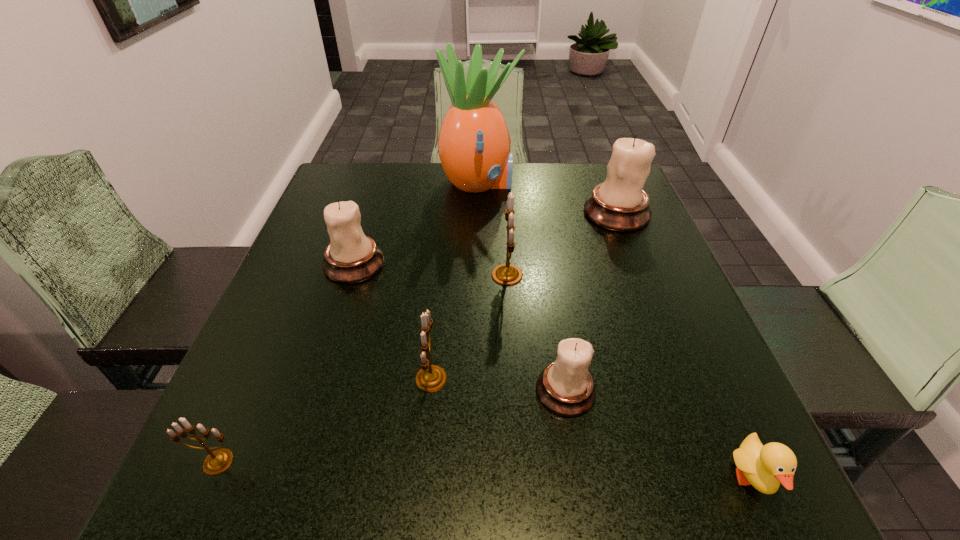
Image resolution: width=960 pixels, height=540 pixels. I want to click on the second candelabrum from right to left, so click(565, 387).

Identify the location of the second white candle holder from right to left. (565, 387).

At what (x,y) coordinates should I click in order to perform the action: click on the smallest gold candelabrum. Please return your answer as a coordinate pair (x, y). Looking at the image, I should click on (218, 461).

Locate an element on the screen. This screenshot has width=960, height=540. the leftmost gold candelabrum is located at coordinates (218, 461).

At what (x,y) coordinates should I click in order to perform the action: click on duckling. Please return your answer as a coordinate pair (x, y). Image resolution: width=960 pixels, height=540 pixels. Looking at the image, I should click on (764, 467).

Identify the location of yellow duckling. (764, 467).

Identify the location of vacant space situated at the entrance of the orange pineapple. pos(586,184).

Locate an element on the screen. Image resolution: width=960 pixels, height=540 pixels. free spot located 0.280m on the left of the farthest white candle holder is located at coordinates (473, 213).

I want to click on free space located on the back of the fourth candelabrum from left to right, so click(x=502, y=205).

What are the coordinates of `free space located 0.390m on the right of the second smallest white candle holder` in the screenshot? It's located at (560, 264).